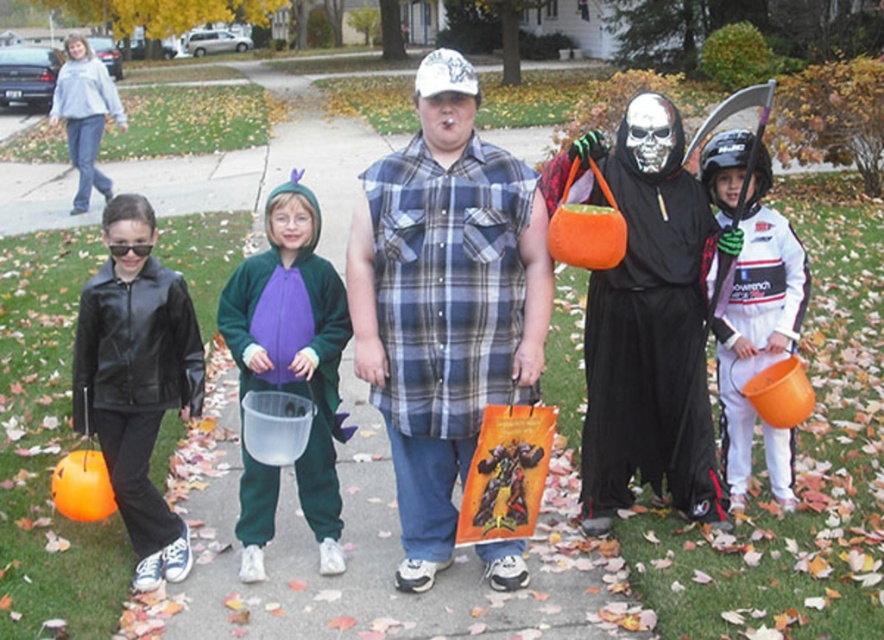
You are a photographer taking a picture of the Halloween scene. You notice the shiny black leather jacket at left and the white matte helmet at upper right. Which object should you focus on first if you want to capture both in the same frame without moving the camera?

You should focus on the shiny black leather jacket at left first because it is closer to the camera than the white matte helmet at upper right, allowing both to be in the same frame without moving the camera.

You are a photographer trying to capture a clear shot of both the shiny black leather jacket at left and the white matte helmet at upper right. Which object should you focus on first to ensure both are in focus?

You should focus on the shiny black leather jacket at left first because it is closer to the viewer than the white matte helmet at upper right. By focusing on the closer object, the helmet will still be within the depth of field.